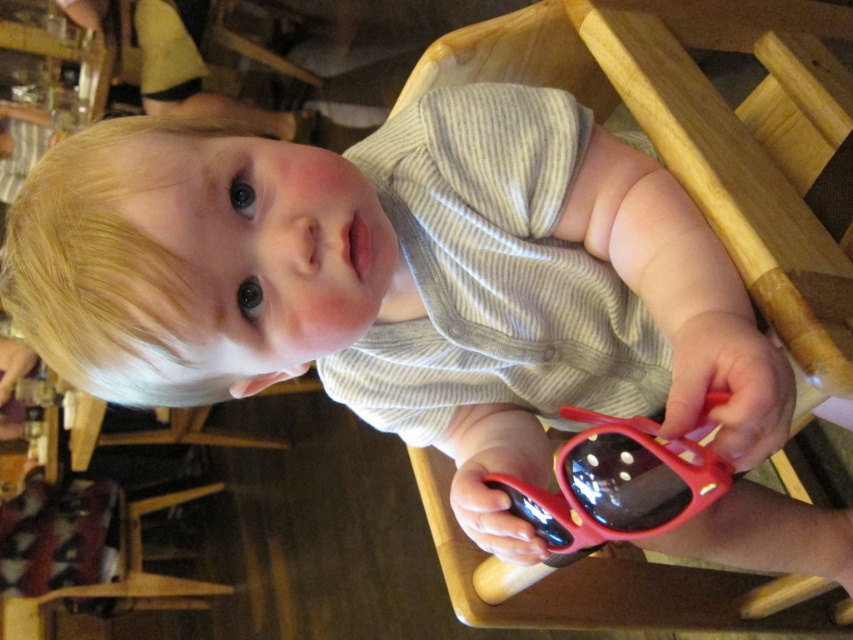
Can you confirm if wooden chair at center is positioned below red rubber sunglasses at center?

Incorrect, wooden chair at center is not positioned below red rubber sunglasses at center.

Which is in front, point (668, 65) or point (611, 417)?

Point (668, 65)

Identify the location of wooden chair at center. (682, 120).